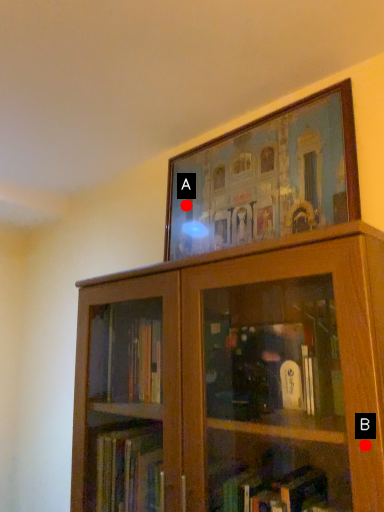
Question: Two points are circled on the image, labeled by A and B beside each circle. Which point is further to the camera?

Choices:
 (A) A is further
 (B) B is further

Answer: (A)